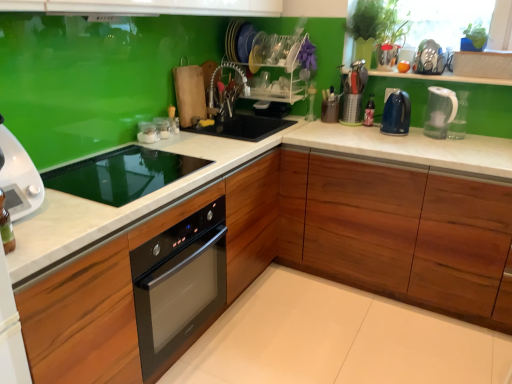
I want to click on vacant space that's between clear plastic bottle at center, the 1th bottle when ordered from right to left, and brown matte utensil holder at center, positioned as the 3th appliance in right-to-left order, so click(351, 125).